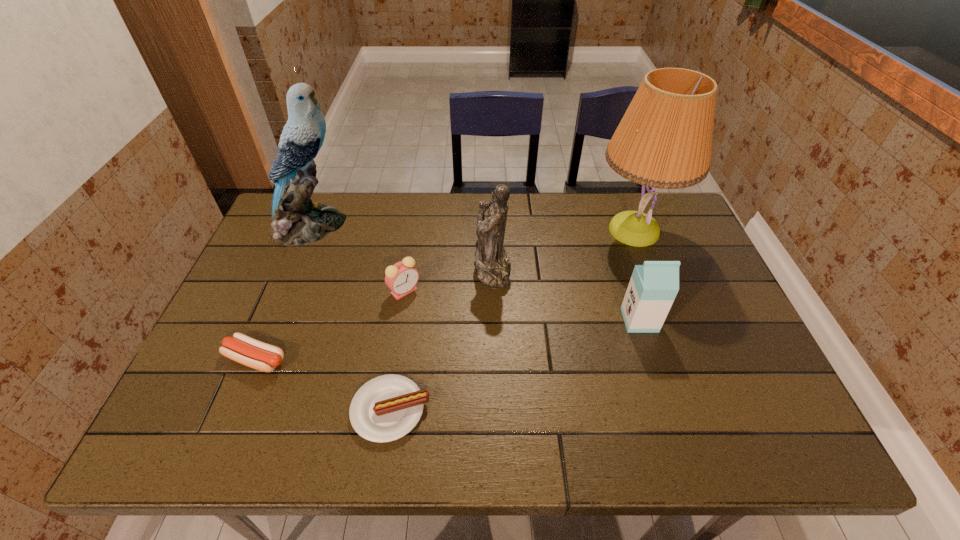
At what (x,y) coordinates should I click in order to perform the action: click on free space located on the back of the taller sausage. Please return your answer as a coordinate pair (x, y). The height and width of the screenshot is (540, 960). Looking at the image, I should click on (290, 279).

I want to click on blank area located on the back of the shortest object, so 412,267.

You are a GUI agent. You are given a task and a screenshot of the screen. Output one action in this format:
    pyautogui.click(x=<x>, y=<y>)
    Task: Click on the lamp at the far edge
    
    Given the screenshot: What is the action you would take?
    pyautogui.click(x=664, y=140)

You are a GUI agent. You are given a task and a screenshot of the screen. Output one action in this format:
    pyautogui.click(x=<x>, y=<y>)
    Task: Click on the parakeet that is positioned at the far edge
    This screenshot has width=960, height=540.
    Given the screenshot: What is the action you would take?
    pyautogui.click(x=296, y=220)

The width and height of the screenshot is (960, 540). In order to click on object that is at the near edge in this screenshot , I will do `click(386, 408)`.

Where is `parakeet present at the left edge`? parakeet present at the left edge is located at coordinates (296, 220).

Where is `sausage that is at the left edge`? The image size is (960, 540). sausage that is at the left edge is located at coordinates (243, 349).

At what (x,y) coordinates should I click in order to perform the action: click on object that is at the right edge. Please return your answer as a coordinate pair (x, y). The width and height of the screenshot is (960, 540). Looking at the image, I should click on (664, 140).

The image size is (960, 540). Find the location of `object that is at the far left corner`. object that is at the far left corner is located at coordinates (296, 220).

The image size is (960, 540). I want to click on object that is at the far right corner, so click(x=664, y=140).